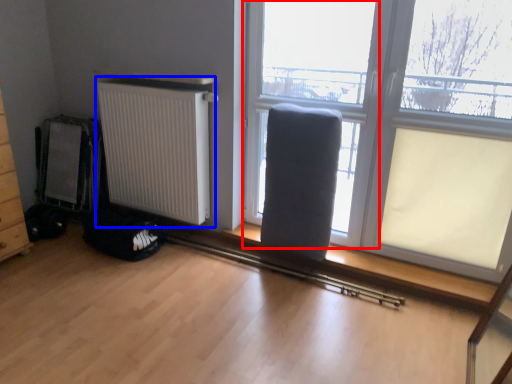
Question: Which point is further to the camera, window frame (highlighted by a red box) or radiator (highlighted by a blue box)?

Choices:
 (A) window frame
 (B) radiator

Answer: (B)